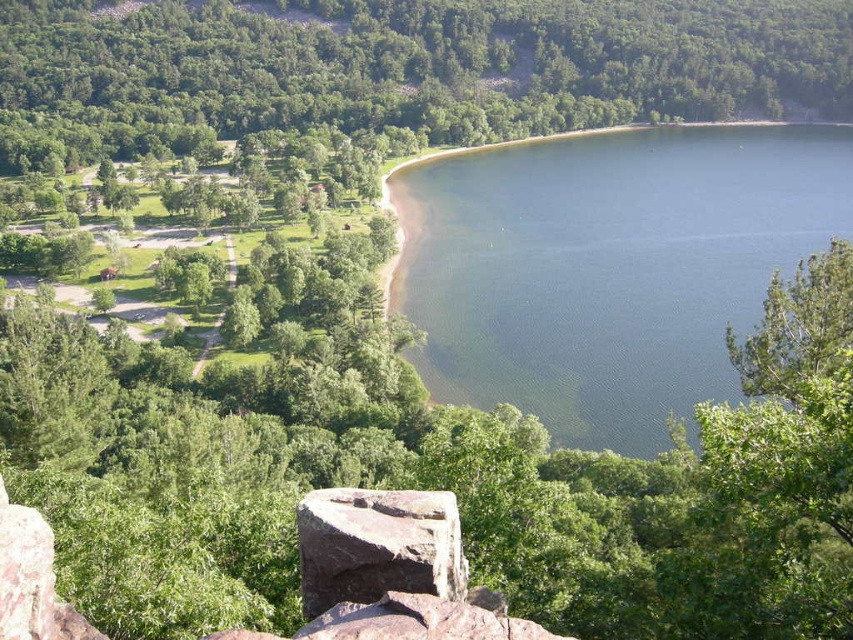
In the scene shown: You are standing in the park area and want to walk to the gray rough rock at center. Which direction should you go relative to the green smooth water at center?

You should move towards the gray rough rock at center, which is behind the green smooth water at center since the green smooth water at center is closer to you.

What are the coordinates of the green leafy tree at upper left in the image?

The green leafy tree at upper left is located at coordinates [422,61].

You are standing at the point marked as point (608, 266) in the image. What type of surface are you currently standing on?

The point (608, 266) is on green smooth water at center, so you are standing on green smooth water at center.